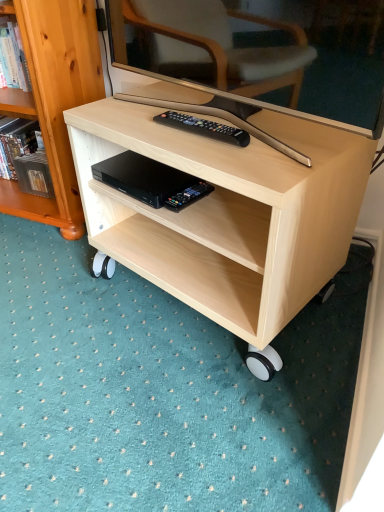
Locate an element on the screen. The height and width of the screenshot is (512, 384). free space to the left of light wood desk at center is located at coordinates pyautogui.click(x=62, y=308).